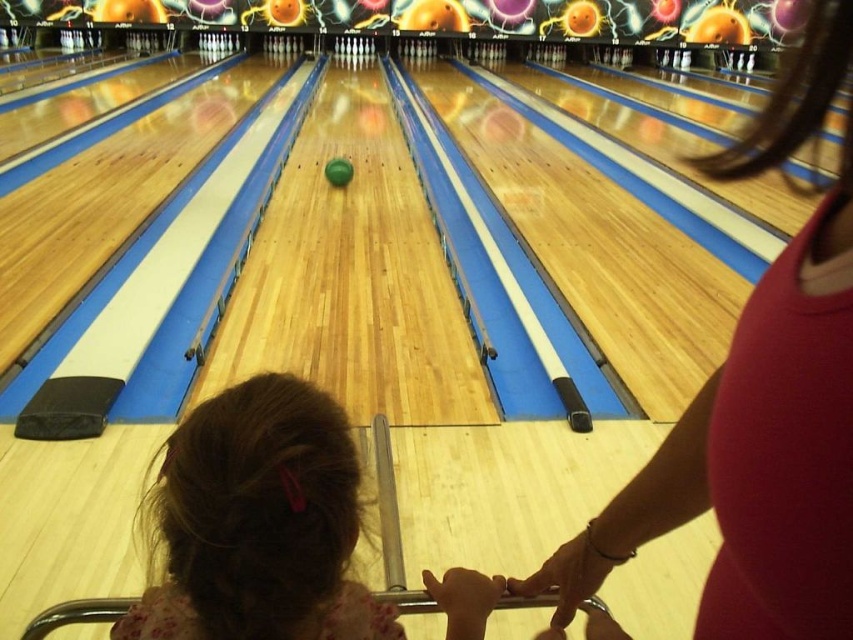
Is the position of pink fabric at upper right more distant than that of brown hair at center?

No, pink fabric at upper right is in front of brown hair at center.

Does pink fabric at upper right appear over brown hair at center?

Indeed, pink fabric at upper right is positioned over brown hair at center.

Between point (833, 0) and point (305, 397), which one is positioned behind?

The point (305, 397) is more distant.

I want to click on pink fabric at upper right, so click(x=753, y=458).

Is brown hair at center taller than green matte bowling ball at center?

Correct, brown hair at center is much taller as green matte bowling ball at center.

What do you see at coordinates (258, 522) in the screenshot? This screenshot has width=853, height=640. I see `brown hair at center` at bounding box center [258, 522].

Which is behind, point (223, 524) or point (340, 163)?

The point (340, 163) is behind.

At what (x,y) coordinates should I click in order to perform the action: click on brown hair at center. Please return your answer as a coordinate pair (x, y). This screenshot has height=640, width=853. Looking at the image, I should click on (258, 522).

Is pink fabric at upper right taller than green matte bowling ball at center?

Correct, pink fabric at upper right is much taller as green matte bowling ball at center.

Does pink fabric at upper right appear on the left side of green matte bowling ball at center?

Incorrect, pink fabric at upper right is not on the left side of green matte bowling ball at center.

Between point (737, 387) and point (341, 186), which one is positioned in front?

Point (737, 387) is more forward.

Image resolution: width=853 pixels, height=640 pixels. In order to click on pink fabric at upper right in this screenshot , I will do `click(753, 458)`.